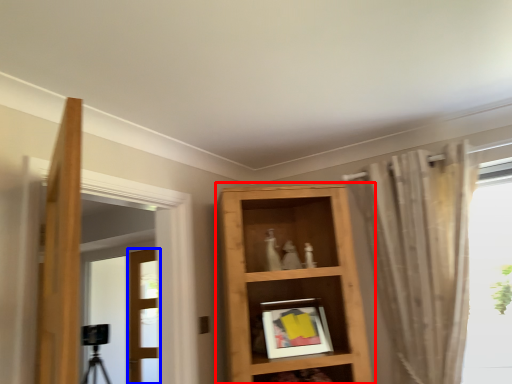
Question: Which of the following is the closest to the observer, shelf (highlighted by a red box) or door (highlighted by a blue box)?

Choices:
 (A) shelf
 (B) door

Answer: (A)